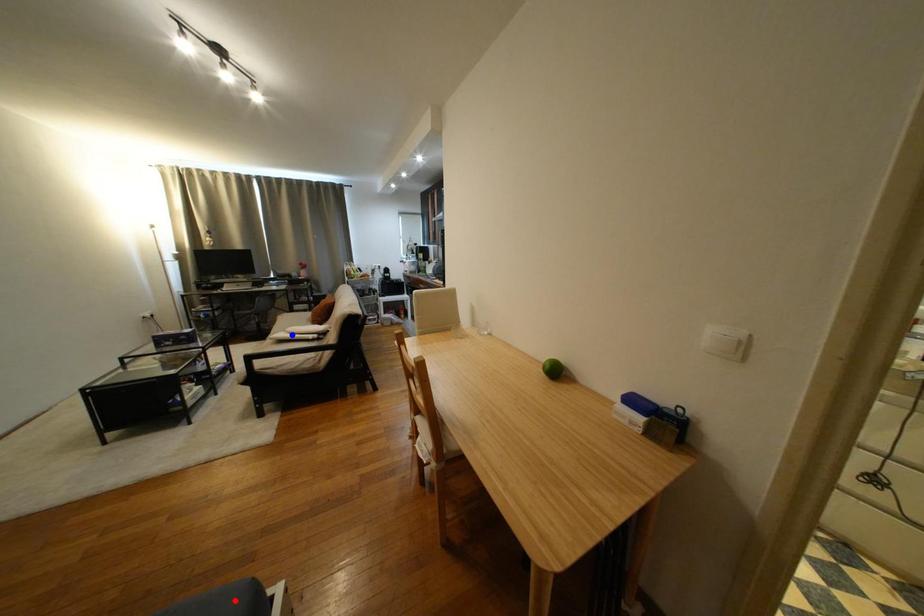
Question: Which of the two points in the image is closer to the camera?

Choices:
 (A) Blue point is closer.
 (B) Red point is closer.

Answer: (B)